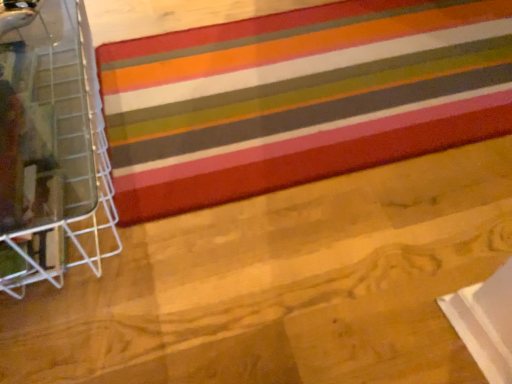
Question: Considering the positions of clear plastic basket at left and multicolored striped rug at center in the image, is clear plastic basket at left wider or thinner than multicolored striped rug at center?

Choices:
 (A) wide
 (B) thin

Answer: (B)

Question: Is clear plastic basket at left in front of or behind multicolored striped rug at center in the image?

Choices:
 (A) front
 (B) behind

Answer: (A)

Question: From the image's perspective, is clear plastic basket at left located above or below multicolored striped rug at center?

Choices:
 (A) below
 (B) above

Answer: (A)

Question: Based on their sizes in the image, would you say multicolored striped rug at center is bigger or smaller than clear plastic basket at left?

Choices:
 (A) big
 (B) small

Answer: (B)

Question: From the image's perspective, is multicolored striped rug at center located above or below clear plastic basket at left?

Choices:
 (A) above
 (B) below

Answer: (A)

Question: Choose the correct answer: Is multicolored striped rug at center inside clear plastic basket at left or outside it?

Choices:
 (A) outside
 (B) inside

Answer: (A)

Question: In the image, is multicolored striped rug at center positioned in front of or behind clear plastic basket at left?

Choices:
 (A) behind
 (B) front

Answer: (A)